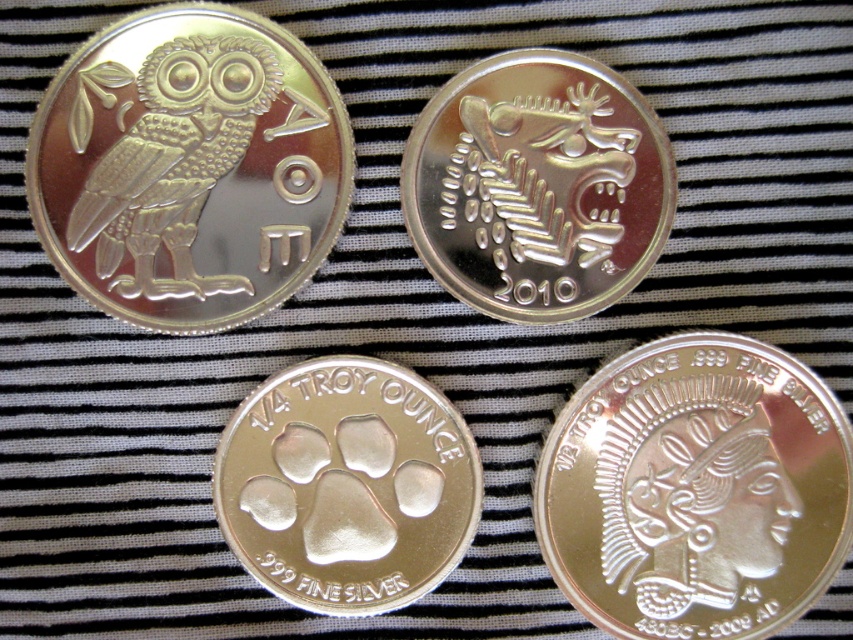
Question: Considering the real-world distances, which object is closest to the polished silver owl at upper left?

Choices:
 (A) polished silver coin at center
 (B) silver/smooth/reindeer at center

Answer: (B)

Question: Does polished silver coin at center have a larger size compared to silver/smooth/reindeer at center?

Choices:
 (A) no
 (B) yes

Answer: (B)

Question: Among these points, which one is farthest from the camera?

Choices:
 (A) (550, 273)
 (B) (369, 577)
 (C) (833, 508)

Answer: (B)

Question: Where is polished silver coin at center located in relation to shiny silver paw print at center in the image?

Choices:
 (A) left
 (B) right

Answer: (B)

Question: Observing the image, what is the correct spatial positioning of polished silver coin at center in reference to shiny silver paw print at center?

Choices:
 (A) below
 (B) above

Answer: (A)

Question: Based on their relative distances, which object is farther from the polished silver owl at upper left?

Choices:
 (A) shiny silver paw print at center
 (B) silver/smooth/reindeer at center
 (C) polished silver coin at center

Answer: (C)